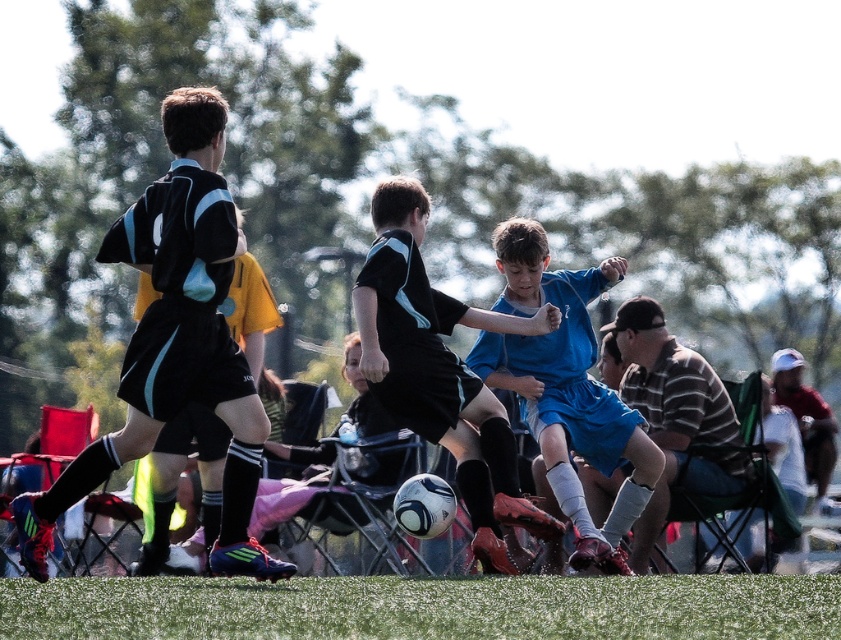
Based on the photo, you are a soccer referee positioned at the center circle. You need to locate the blue matte shorts at center. Where exactly should you look relative to the center of the field?

The blue matte shorts at center is located at point 0.603 on the x axis and 0.673 on the y axis relative to the center of the field.

Based on the photo, you are a referee observing the soccer match. You notice a point at coordinates (x=564, y=385). What object is located at that point?

The blue matte shorts at center are located at point (x=564, y=385).